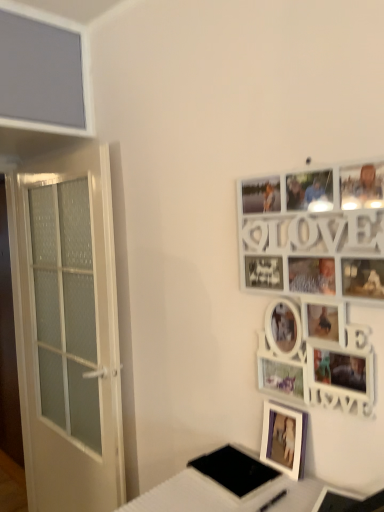
Question: Could you tell me if white frosted glass door at left is turned towards white wooden picture frame at upper right, acting as the 1th picture frame starting from the top?

Choices:
 (A) no
 (B) yes

Answer: (A)

Question: From a real-world perspective, is white frosted glass door at left physically below white wooden picture frame at upper right, acting as the 1th picture frame starting from the top?

Choices:
 (A) no
 (B) yes

Answer: (B)

Question: Is white frosted glass door at left positioned in front of white wooden picture frame at upper right, acting as the 1th picture frame starting from the top?

Choices:
 (A) no
 (B) yes

Answer: (A)

Question: Is white frosted glass door at left positioned far away from white wooden picture frame at upper right, acting as the 1th picture frame starting from the top?

Choices:
 (A) no
 (B) yes

Answer: (A)

Question: Is white frosted glass door at left positioned with its back to white wooden picture frame at upper right, which appears as the second picture frame when ordered from the bottom?

Choices:
 (A) no
 (B) yes

Answer: (A)

Question: Considering the positions of white glossy table at lower right and white frosted glass door at left in the image, is white glossy table at lower right taller or shorter than white frosted glass door at left?

Choices:
 (A) short
 (B) tall

Answer: (A)

Question: In the image, is white glossy table at lower right positioned in front of or behind white frosted glass door at left?

Choices:
 (A) behind
 (B) front

Answer: (B)

Question: Is white glossy table at lower right inside the boundaries of white frosted glass door at left, or outside?

Choices:
 (A) outside
 (B) inside

Answer: (A)

Question: Considering the positions of white glossy table at lower right and white frosted glass door at left in the image, is white glossy table at lower right wider or thinner than white frosted glass door at left?

Choices:
 (A) thin
 (B) wide

Answer: (B)

Question: Is white frosted glass door at left taller or shorter than white wooden picture frame at upper right, acting as the 1th picture frame starting from the top?

Choices:
 (A) tall
 (B) short

Answer: (A)

Question: Visually, is white frosted glass door at left positioned to the left or to the right of white wooden picture frame at upper right, acting as the 1th picture frame starting from the top?

Choices:
 (A) right
 (B) left

Answer: (B)

Question: Choose the correct answer: Is white frosted glass door at left inside white wooden picture frame at upper right, acting as the 1th picture frame starting from the top, or outside it?

Choices:
 (A) outside
 (B) inside

Answer: (A)

Question: Does point (94, 356) appear closer or farther from the camera than point (274, 202)?

Choices:
 (A) farther
 (B) closer

Answer: (A)

Question: Looking at their shapes, would you say purple matte picture frame at lower right, which is the 2th picture frame from top to bottom, is wider or thinner than black matte pad at lower center?

Choices:
 (A) wide
 (B) thin

Answer: (B)

Question: From a real-world perspective, is purple matte picture frame at lower right, the 1th picture frame from the bottom, positioned above or below black matte pad at lower center?

Choices:
 (A) above
 (B) below

Answer: (A)